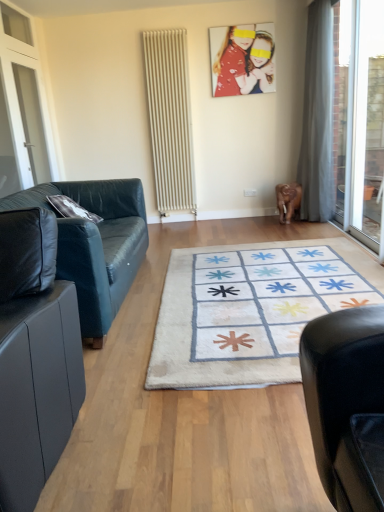
Question: Visually, is white glass screen door at left positioned to the left or to the right of beige textured radiator at center?

Choices:
 (A) right
 (B) left

Answer: (B)

Question: Based on their sizes in the image, would you say white glass screen door at left is bigger or smaller than beige textured radiator at center?

Choices:
 (A) small
 (B) big

Answer: (A)

Question: Which of these objects is positioned farthest from the gray fabric curtain at right?

Choices:
 (A) white soft rug at center
 (B) transparent glass door at right
 (C) matte plastic photo frame at upper center
 (D) white glass screen door at left
 (E) black leather couch at left, arranged as the second studio couch when viewed from the back

Answer: (E)

Question: Which is nearer to the gray fabric curtain at right?

Choices:
 (A) black leather couch at left, positioned as the 1th studio couch in back-to-front order
 (B) black leather couch at left, arranged as the second studio couch when viewed from the back
 (C) transparent glass door at right
 (D) white glass screen door at left
 (E) white soft rug at center

Answer: (C)